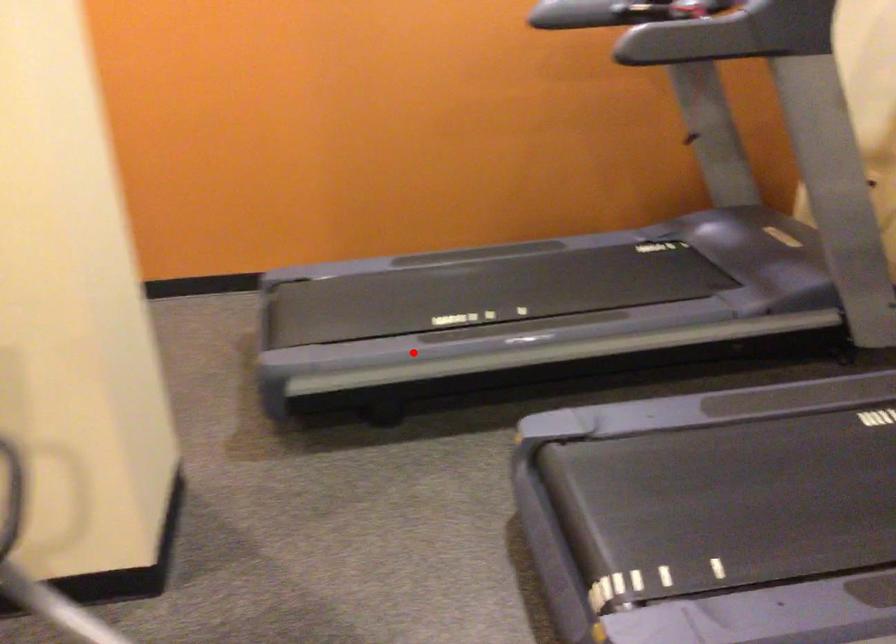
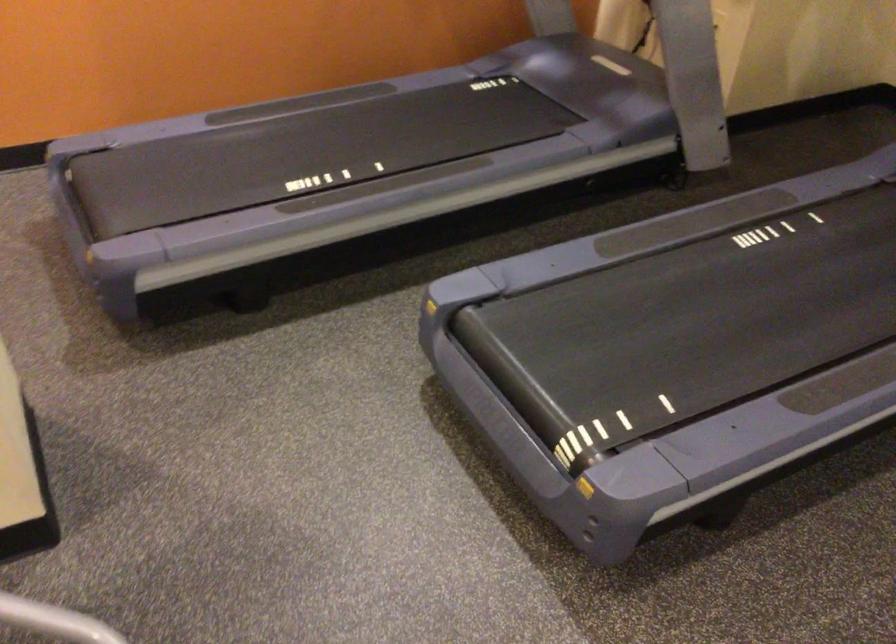
Question: A red point is marked in image1. In image2, is the corresponding 3D point closer to the camera or farther? Reply with the corresponding letter.

Choices:
 (A) The corresponding 3D point is closer.
 (B) The corresponding 3D point is farther.

Answer: (A)